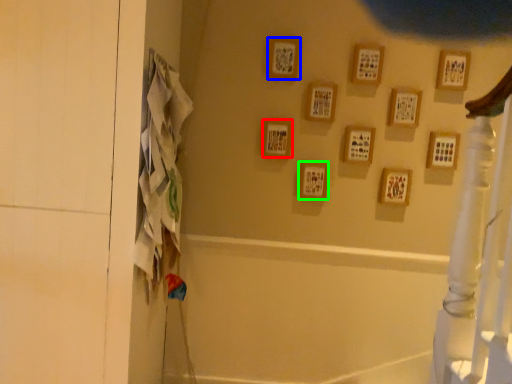
Question: Estimate the real-world distances between objects in this image. Which object is closer to picture frame (highlighted by a red box), picture frame (highlighted by a blue box) or picture frame (highlighted by a green box)?

Choices:
 (A) picture frame
 (B) picture frame

Answer: (B)